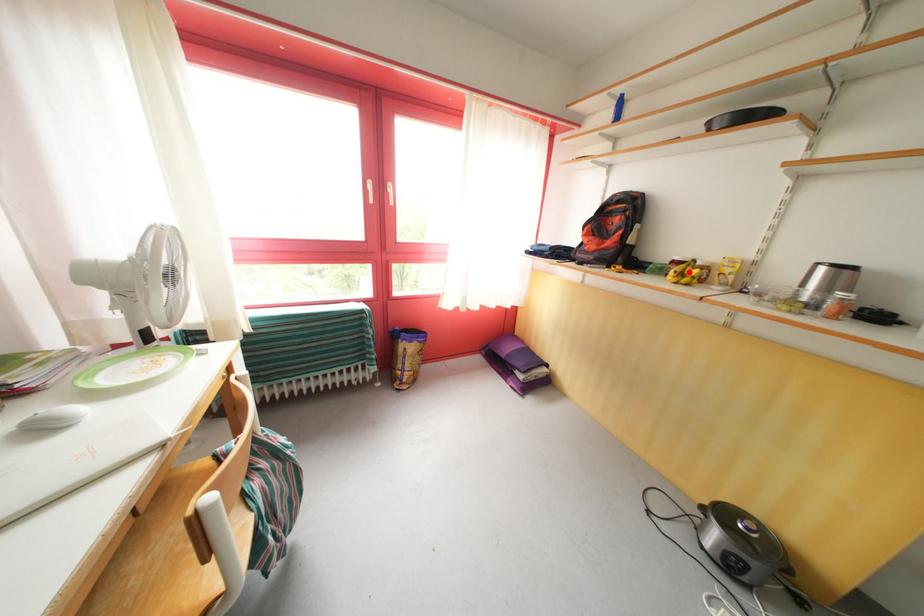
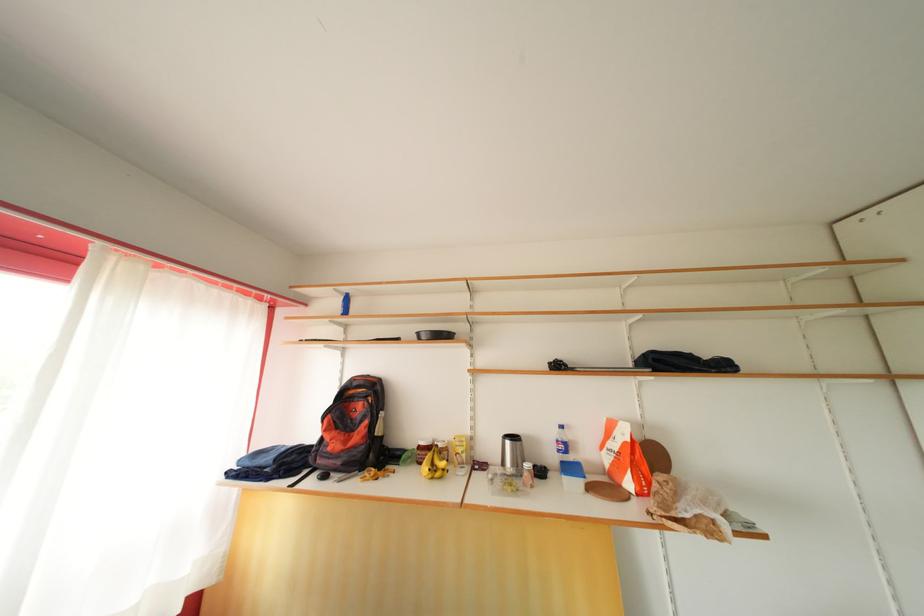
Find the pixel in the second image that matches the highlighted location in the first image.

(436, 461)